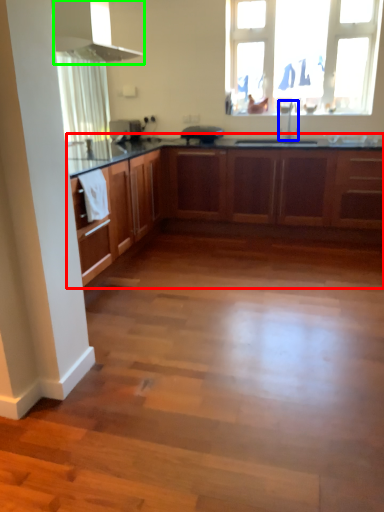
Question: Which object is the farthest from cabinetry (highlighted by a red box)? Choose among these: tap (highlighted by a blue box) or exhaust hood (highlighted by a green box).

Choices:
 (A) tap
 (B) exhaust hood

Answer: (B)